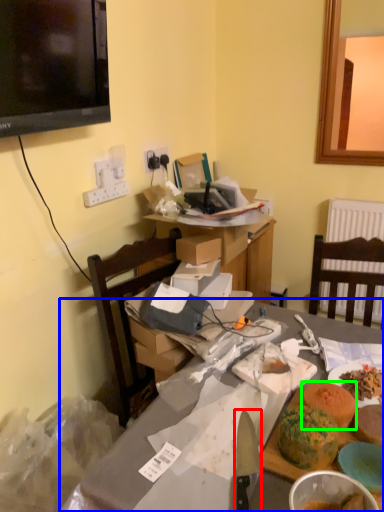
Question: Which is nearer to the knife (highlighted by a red box)? table (highlighted by a blue box) or food (highlighted by a green box).

Choices:
 (A) table
 (B) food

Answer: (B)